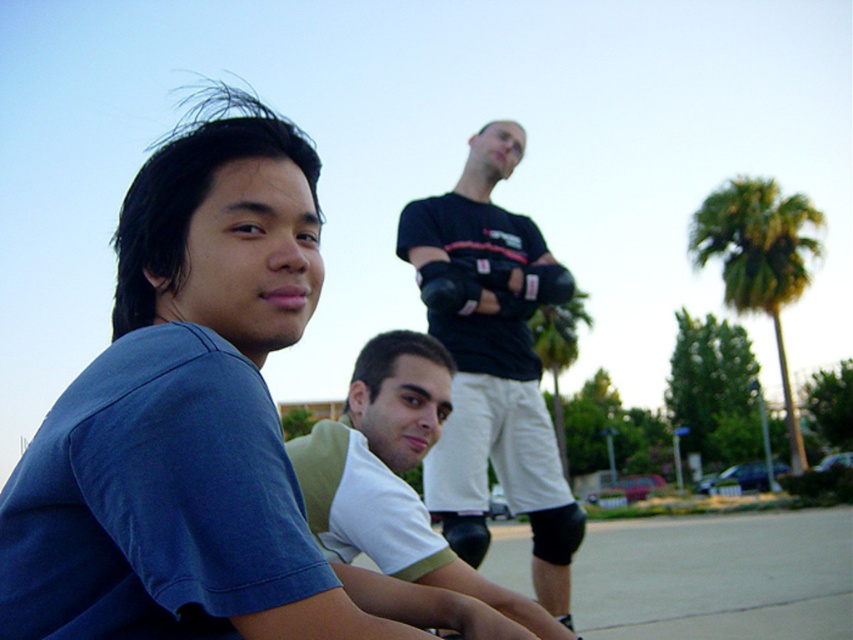
You are standing in the scene and want to place a small potted plant between the white jersey at center and the green leafy palm tree at right. According to their positions, which object should the potted plant be closer to?

The potted plant should be placed closer to the green leafy palm tree at right because the white jersey at center is to the left of the green leafy palm tree at right, so the palm tree is on the right side relative to the jersey.